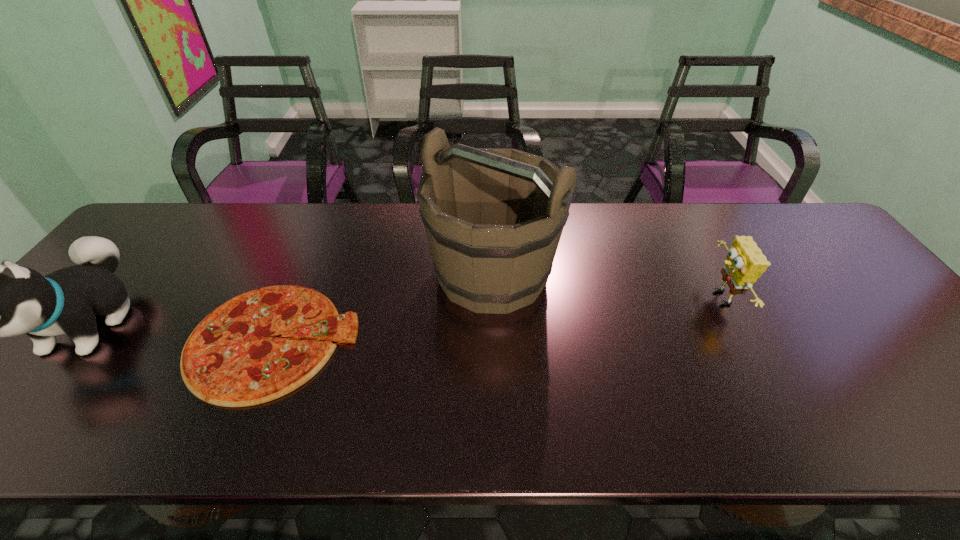
This screenshot has height=540, width=960. Identify the location of vacant space positioned 0.400m on the right of the pizza. (524, 340).

Where is `object present at the far edge`? object present at the far edge is located at coordinates (494, 217).

At what (x,y) coordinates should I click in order to perform the action: click on object located at the near edge. Please return your answer as a coordinate pair (x, y). The height and width of the screenshot is (540, 960). Looking at the image, I should click on click(230, 359).

Where is `vacant space at the far edge of the desktop`? This screenshot has height=540, width=960. vacant space at the far edge of the desktop is located at coordinates (213, 205).

Where is `vacant space at the near edge of the desktop`? This screenshot has height=540, width=960. vacant space at the near edge of the desktop is located at coordinates (823, 416).

At what (x,y) coordinates should I click in order to perform the action: click on vacant space at the left edge of the desktop. Please return your answer as a coordinate pair (x, y). Looking at the image, I should click on (55, 359).

Find the location of a particular element. Image resolution: width=960 pixels, height=540 pixels. vacant position at the right edge of the desktop is located at coordinates (935, 400).

Find the location of `vacant space at the far right corner of the desktop`. vacant space at the far right corner of the desktop is located at coordinates (814, 239).

Identify the location of vacant area that lies between the third object from right to left and the second object from right to left. tap(383, 307).

Locate an element on the screen. This screenshot has width=960, height=540. vacant region between the shortest object and the tallest object is located at coordinates (383, 307).